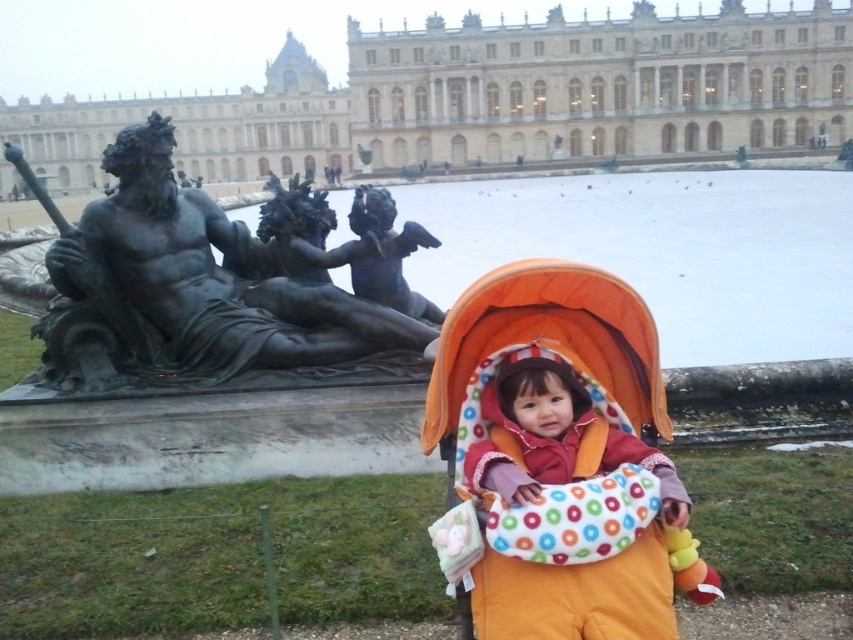
You are a parent pushing the orange fabric baby carriage at center towards the entrance of the grand building. As you look up, you notice the bronze cherub at center above you. Can you determine the spatial relationship between the two objects?

The orange fabric baby carriage at center is below the bronze cherub at center, meaning the bronze cherub is positioned above the carriage in the scene.

You are a tour guide leading a group and want to ensure the orange fabric baby carriage at center can fit between the bronze statue at left and the building. Can you confirm if the space between them is wide enough?

The bronze statue at left is wider than the orange fabric baby carriage at center, so there should be sufficient space for the carriage to pass between the statue and the building.

From the picture: You are a parent pushing an orange fabric baby carriage at center and need to pass by a bronze cherub at center. Considering their sizes, will the baby carriage require more space to maneuver around the statue?

The orange fabric baby carriage at center is larger in size than the bronze cherub at center, so it would require more space to maneuver around the statue.